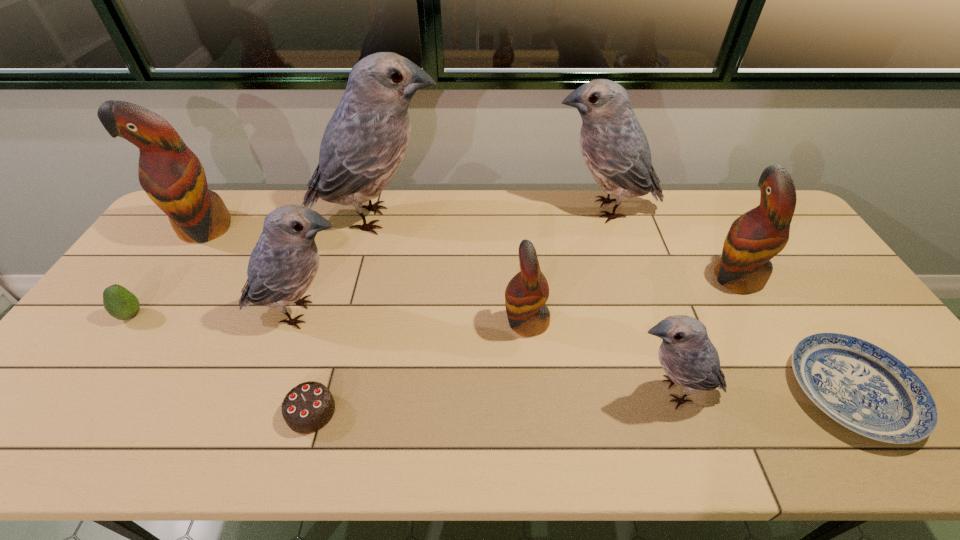
I want to click on blank space that satisfies the following two spatial constraints: 1. on the front-facing side of the blue plate; 2. on the right side of the second biggest gray parrot, so click(661, 392).

Where is `free space that satisfies the following two spatial constraints: 1. on the face of the shortest object; 2. on the right side of the rightmost parrot`? Image resolution: width=960 pixels, height=540 pixels. free space that satisfies the following two spatial constraints: 1. on the face of the shortest object; 2. on the right side of the rightmost parrot is located at coordinates click(799, 392).

At what (x,y) coordinates should I click in order to perform the action: click on vacant space that satisfies the following two spatial constraints: 1. on the face of the fourth parrot from right to left; 2. on the back side of the shortest object. Please return your answer as a coordinate pair (x, y). Looking at the image, I should click on click(533, 392).